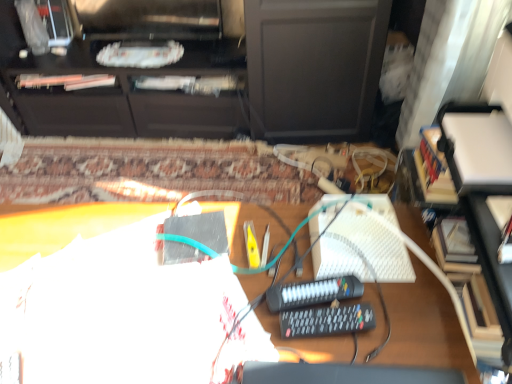
Question: Is point (382, 200) closer or farther from the camera than point (281, 291)?

Choices:
 (A) farther
 (B) closer

Answer: (A)

Question: From a real-world perspective, is white textured keyboard at center-right positioned above or below black plastic remote control at center, which appears as the second equipment when viewed from the front?

Choices:
 (A) below
 (B) above

Answer: (B)

Question: Which object is positioned closest to the black matte cabinet at upper center?

Choices:
 (A) white matte desk at center
 (B) black plastic remote control at center, which appears as the second equipment when viewed from the front
 (C) black plastic remote control at center, marked as the 1th equipment in a front-to-back arrangement
 (D) white textured keyboard at center-right

Answer: (A)

Question: Based on their relative distances, which object is farther from the black matte cabinet at upper center?

Choices:
 (A) white matte desk at center
 (B) black plastic remote control at center, marked as the 1th equipment in a front-to-back arrangement
 (C) white textured keyboard at center-right
 (D) black plastic remote control at center, which appears as the second equipment when viewed from the front

Answer: (B)